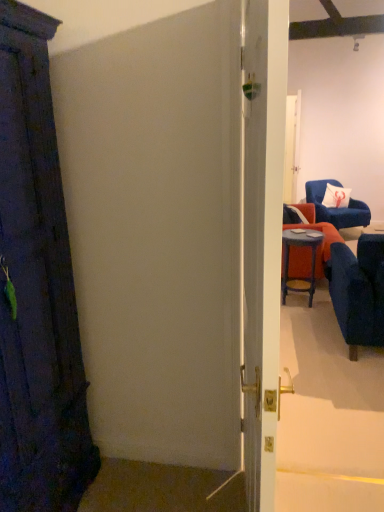
What is the approximate height of velvet blue armchair at right, placed as the first chair when sorted from left to right?

It is 34.12 inches.

Locate an element on the screen. velvet blue armchair at upper right, arranged as the 2th chair when ordered from the bottom is located at coordinates (336, 207).

Where is `matte blue stool at right`? matte blue stool at right is located at coordinates (288, 261).

From the image's perspective, is white glossy door at center positioned above or below white fabric pillow at upper right?

Clearly, from the image's perspective, white glossy door at center is below white fabric pillow at upper right.

Considering the positions of objects white glossy door at center and white fabric pillow at upper right in the image provided, who is more to the right, white glossy door at center or white fabric pillow at upper right?

white fabric pillow at upper right.

From the picture: Is white glossy door at center facing away from white fabric pillow at upper right?

No, white fabric pillow at upper right is not at the back of white glossy door at center.

Is point (252, 53) more distant than point (329, 183)?

No.

Is matte blue stool at right facing away from velvet blue armchair at right, which is the 2th chair in back-to-front order?

No.

Consider the image. From a real-world perspective, is matte blue stool at right physically located above or below velvet blue armchair at right, placed as the first chair when sorted from left to right?

Clearly, from a real-world perspective, matte blue stool at right is below velvet blue armchair at right, placed as the first chair when sorted from left to right.

Is matte blue stool at right wider than velvet blue armchair at right, placed as the first chair when sorted from left to right?

No.

Which object is closer to the camera, white fabric pillow at upper right or matte blue stool at right?

matte blue stool at right is in front.

Considering the relative sizes of white fabric pillow at upper right and matte blue stool at right in the image provided, is white fabric pillow at upper right wider than matte blue stool at right?

In fact, white fabric pillow at upper right might be narrower than matte blue stool at right.

Identify the location of pillow that is above the matte blue stool at right (from a real-world perspective). (336, 196).

From the image's perspective, who appears lower, velvet blue armchair at right, which is the 2th chair in back-to-front order, or white fabric pillow at upper right?

velvet blue armchair at right, which is the 2th chair in back-to-front order, is shown below in the image.

Which of these two, velvet blue armchair at right, the second chair positioned from the right, or white fabric pillow at upper right, stands taller?

velvet blue armchair at right, the second chair positioned from the right.

Is velvet blue armchair at right, which is the 2th chair in back-to-front order, looking in the opposite direction of white fabric pillow at upper right?

velvet blue armchair at right, which is the 2th chair in back-to-front order, does not have its back to white fabric pillow at upper right.

Between point (351, 271) and point (343, 201), which one is positioned behind?

Positioned behind is point (343, 201).

Is white glossy door at center oriented towards velvet blue armchair at upper right, positioned as the first chair in right-to-left order?

No, white glossy door at center is not facing towards velvet blue armchair at upper right, positioned as the first chair in right-to-left order.

You are a GUI agent. You are given a task and a screenshot of the screen. Output one action in this format:
    pyautogui.click(x=<x>, y=<y>)
    Task: Click on the door that appears below the velvet blue armchair at upper right, arranged as the 2th chair when ordered from the bottom (from the image's perspective)
    The width and height of the screenshot is (384, 512).
    Given the screenshot: What is the action you would take?
    pyautogui.click(x=262, y=238)

From the picture: Between white glossy door at center and velvet blue armchair at upper right, arranged as the 2th chair when ordered from the bottom, which one has larger size?

velvet blue armchair at upper right, arranged as the 2th chair when ordered from the bottom.

Can you tell me how much white glossy door at center and velvet blue armchair at upper right, the second chair from the front, differ in facing direction?

72 degrees.

The image size is (384, 512). I want to click on table directly beneath the white fabric pillow at upper right (from a real-world perspective), so [288, 261].

Is matte blue stool at right touching white fabric pillow at upper right?

No, matte blue stool at right is not beside white fabric pillow at upper right.

From the image's perspective, is matte blue stool at right under white fabric pillow at upper right?

Correct, matte blue stool at right appears lower than white fabric pillow at upper right in the image.

Is matte blue stool at right inside or outside of white fabric pillow at upper right?

matte blue stool at right is not inside white fabric pillow at upper right, it's outside.

You are a GUI agent. You are given a task and a screenshot of the screen. Output one action in this format:
    pyautogui.click(x=<x>, y=<y>)
    Task: Click on the table in front of the velvet blue armchair at upper right, the second chair from the front
    This screenshot has height=512, width=384.
    Given the screenshot: What is the action you would take?
    pyautogui.click(x=288, y=261)

Is matte blue stool at right inside the boundaries of velvet blue armchair at upper right, marked as the 2th chair in a left-to-right arrangement, or outside?

The correct answer is: outside.

Can you confirm if matte blue stool at right is smaller than velvet blue armchair at upper right, arranged as the 2th chair when ordered from the bottom?

Yes, matte blue stool at right is smaller than velvet blue armchair at upper right, arranged as the 2th chair when ordered from the bottom.

From a real-world perspective, between matte blue stool at right and velvet blue armchair at upper right, arranged as the 2th chair when ordered from the bottom, who is vertically higher?

velvet blue armchair at upper right, arranged as the 2th chair when ordered from the bottom, is physically above.

Locate an element on the screen. The height and width of the screenshot is (512, 384). door located on the left of white fabric pillow at upper right is located at coordinates (262, 238).

Locate an element on the screen. chair below the matte blue stool at right (from the image's perspective) is located at coordinates (358, 291).

From the picture: Based on their spatial positions, is velvet blue armchair at upper right, marked as the 2th chair in a left-to-right arrangement, or velvet blue armchair at right, the second chair positioned from the right, closer to white fabric pillow at upper right?

velvet blue armchair at upper right, marked as the 2th chair in a left-to-right arrangement.

Considering their positions, is white fabric pillow at upper right positioned closer to velvet blue armchair at right, which is counted as the 2th chair, starting from the top, than velvet blue armchair at upper right, marked as the 2th chair in a left-to-right arrangement?

Based on the image, velvet blue armchair at upper right, marked as the 2th chair in a left-to-right arrangement, appears to be nearer to velvet blue armchair at right, which is counted as the 2th chair, starting from the top.

Based on their spatial positions, is white glossy door at center or velvet blue armchair at upper right, the second chair from the front, closer to velvet blue armchair at right, which is the 2th chair in back-to-front order?

velvet blue armchair at upper right, the second chair from the front, is positioned closer to the anchor velvet blue armchair at right, which is the 2th chair in back-to-front order.

Estimate the real-world distances between objects in this image. Which object is further from white fabric pillow at upper right, white glossy door at center or matte blue stool at right?

Among the two, white glossy door at center is located further to white fabric pillow at upper right.

Looking at the image, which one is located further to velvet blue armchair at right, placed as the first chair when sorted from left to right, velvet blue armchair at upper right, arranged as the 2th chair when ordered from the bottom, or white glossy door at center?

Among the two, white glossy door at center is located further to velvet blue armchair at right, placed as the first chair when sorted from left to right.

From the image, which object appears to be nearer to matte blue stool at right, white glossy door at center or velvet blue armchair at right, the second chair positioned from the right?

velvet blue armchair at right, the second chair positioned from the right.

Based on their spatial positions, is velvet blue armchair at right, placed as the first chair when sorted from left to right, or white glossy door at center closer to velvet blue armchair at upper right, positioned as the first chair in right-to-left order?

The object closer to velvet blue armchair at upper right, positioned as the first chair in right-to-left order, is velvet blue armchair at right, placed as the first chair when sorted from left to right.

When comparing their distances from matte blue stool at right, does white glossy door at center or white fabric pillow at upper right seem further?

white glossy door at center is positioned further to the anchor matte blue stool at right.

Find the location of a particular element. The image size is (384, 512). chair located between white glossy door at center and matte blue stool at right in the depth direction is located at coordinates (358, 291).

Where is `chair located between white glossy door at center and velvet blue armchair at upper right, positioned as the first chair in right-to-left order, in the depth direction`? The image size is (384, 512). chair located between white glossy door at center and velvet blue armchair at upper right, positioned as the first chair in right-to-left order, in the depth direction is located at coordinates (358, 291).

Image resolution: width=384 pixels, height=512 pixels. In order to click on table between velvet blue armchair at right, which is the 2th chair in back-to-front order, and white fabric pillow at upper right in the front-back direction in this screenshot , I will do `click(288, 261)`.

Locate an element on the screen. This screenshot has width=384, height=512. table between velvet blue armchair at right, arranged as the first chair when ordered from the bottom, and velvet blue armchair at upper right, arranged as the 2th chair when ordered from the bottom, in the front-back direction is located at coordinates (288, 261).